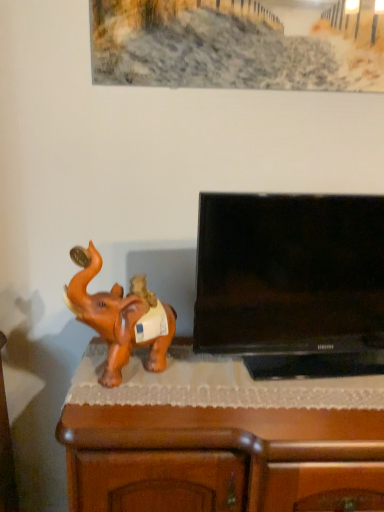
Question: Would you say brown glossy elephant at left is inside or outside black glossy flat-screen tv at right?

Choices:
 (A) inside
 (B) outside

Answer: (B)

Question: Looking at their shapes, would you say brown glossy elephant at left is wider or thinner than black glossy flat-screen tv at right?

Choices:
 (A) thin
 (B) wide

Answer: (A)

Question: Considering the real-world distances, which object is farthest from the brown glossy elephant at left?

Choices:
 (A) black glossy flat-screen tv at right
 (B) brown wood cabinet at lower left

Answer: (A)

Question: Estimate the real-world distances between objects in this image. Which object is farther from the brown glossy elephant at left?

Choices:
 (A) brown wood cabinet at lower left
 (B) black glossy flat-screen tv at right

Answer: (B)